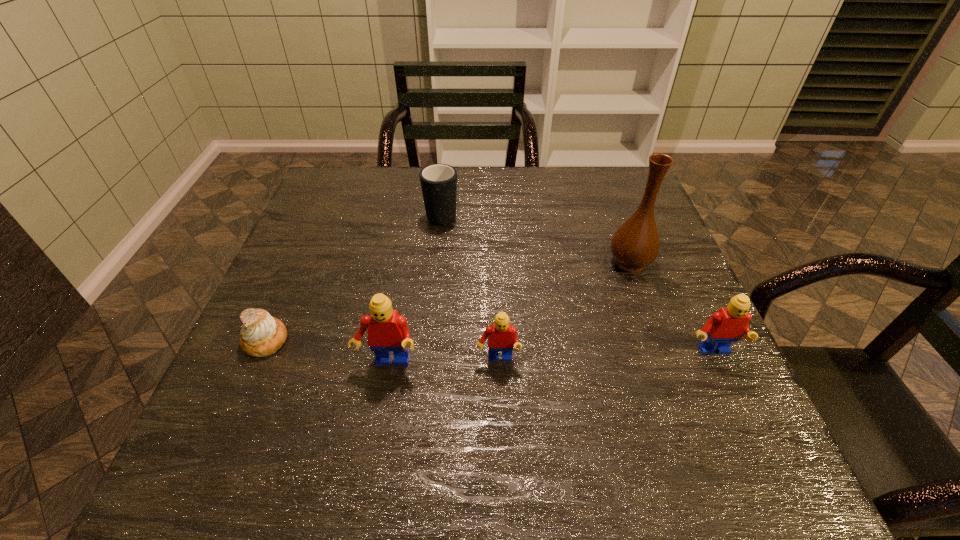
Locate an element on the screen. the leftmost Lego is located at coordinates (388, 331).

I want to click on the third object from right to left, so click(x=502, y=336).

The height and width of the screenshot is (540, 960). Find the location of `the shortest Lego`. the shortest Lego is located at coordinates (502, 336).

Locate an element on the screen. This screenshot has height=540, width=960. the second tallest Lego is located at coordinates (729, 324).

Identify the location of the farthest object. (438, 182).

Where is `vase`? The height and width of the screenshot is (540, 960). vase is located at coordinates (635, 245).

Where is `the tallest object`? The height and width of the screenshot is (540, 960). the tallest object is located at coordinates (635, 245).

Locate an element on the screen. The width and height of the screenshot is (960, 540). the leftmost object is located at coordinates (262, 335).

Locate an element on the screen. pastry is located at coordinates (262, 335).

Identify the location of free space located on the front-facing side of the second Lego from right to left. (499, 401).